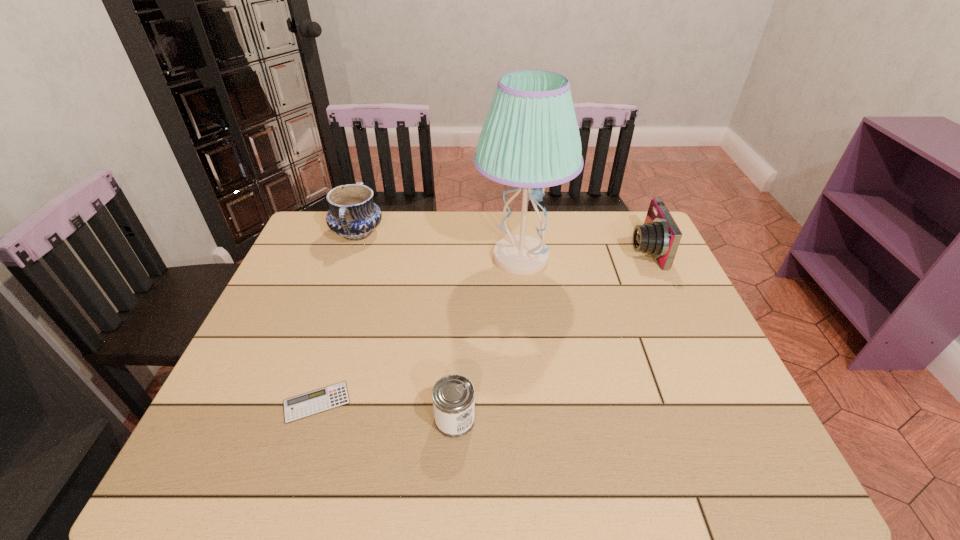
The image size is (960, 540). I want to click on vacant space located 0.230m on the back of the second shortest object, so click(x=460, y=325).

The image size is (960, 540). I want to click on free region located 0.140m on the right of the calculator, so click(x=415, y=402).

Identify the location of lamp positioned at the far edge. This screenshot has height=540, width=960. (530, 139).

Locate an element on the screen. This screenshot has height=540, width=960. pottery that is at the far edge is located at coordinates (353, 215).

Where is `camera positioned at the far edge`? This screenshot has width=960, height=540. camera positioned at the far edge is located at coordinates (659, 236).

What are the coordinates of `object positioned at the near edge` in the screenshot? It's located at (453, 396).

Find the location of a particular element. This screenshot has width=960, height=540. pottery situated at the left edge is located at coordinates (353, 215).

Find the location of a particular element. The height and width of the screenshot is (540, 960). calculator located at the left edge is located at coordinates (320, 400).

The image size is (960, 540). Identify the location of object situated at the right edge. (659, 236).

Identify the location of object positioned at the far left corner. The image size is (960, 540). (353, 215).